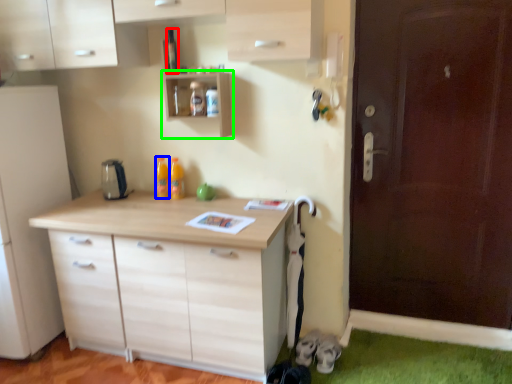
Question: Estimate the real-world distances between objects in this image. Which object is closer to bottle (highlighted by a red box), bottle (highlighted by a blue box) or shelf (highlighted by a green box)?

Choices:
 (A) bottle
 (B) shelf

Answer: (B)